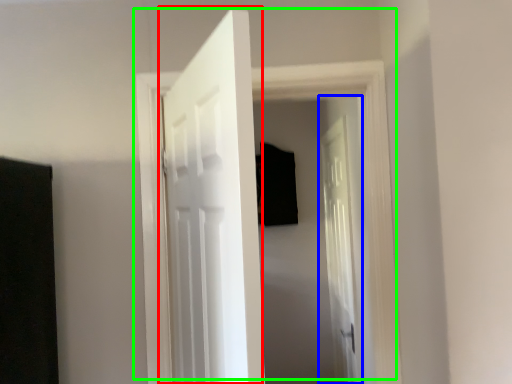
Question: Which object is positioned closest to door (highlighted by a red box)? Select from door (highlighted by a blue box) and door (highlighted by a green box).

Choices:
 (A) door
 (B) door

Answer: (B)